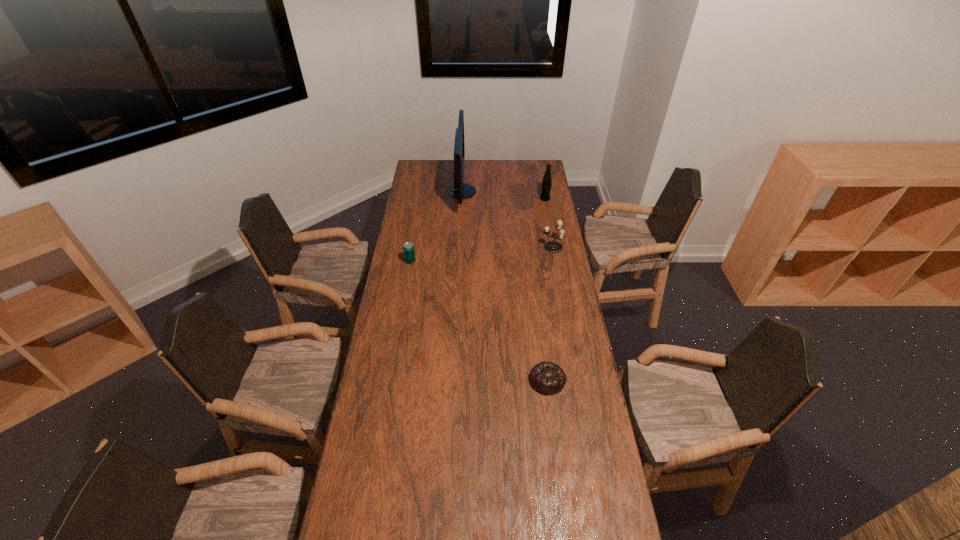
Image resolution: width=960 pixels, height=540 pixels. Find the location of `vacant region that satisfies the following two spatial constraints: 1. on the front-facing side of the third tallest object; 2. on the left side of the computer monitor`. vacant region that satisfies the following two spatial constraints: 1. on the front-facing side of the third tallest object; 2. on the left side of the computer monitor is located at coordinates (460, 247).

Find the location of `free spot that satisfies the following two spatial constraints: 1. on the front-facing side of the beanbag; 2. on the right side of the computer monitor`. free spot that satisfies the following two spatial constraints: 1. on the front-facing side of the beanbag; 2. on the right side of the computer monitor is located at coordinates tap(453, 380).

I want to click on vacant position in the image that satisfies the following two spatial constraints: 1. on the front-facing side of the third tallest object; 2. on the right side of the fourth object from right to left, so click(x=460, y=247).

The image size is (960, 540). I want to click on blank area in the image that satisfies the following two spatial constraints: 1. on the front-facing side of the computer monitor; 2. on the left side of the nearest object, so click(x=453, y=380).